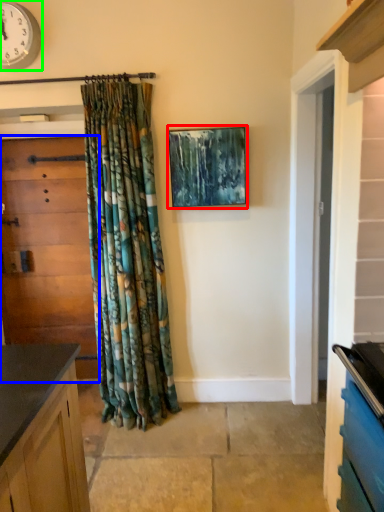
Question: Based on their relative distances, which object is nearer to picture frame (highlighted by a red box)? Choose from door (highlighted by a blue box) and clock (highlighted by a green box).

Choices:
 (A) door
 (B) clock

Answer: (A)